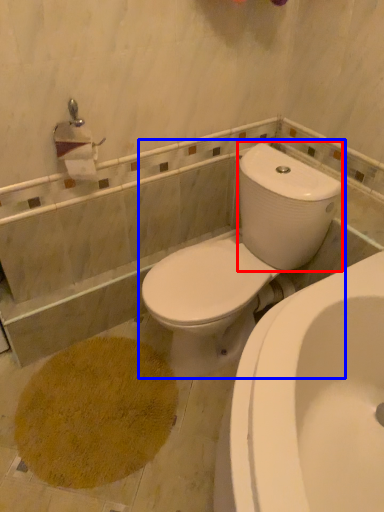
Question: Which object appears farthest to the camera in this image, water tank (highlighted by a red box) or toilet (highlighted by a blue box)?

Choices:
 (A) water tank
 (B) toilet

Answer: (A)